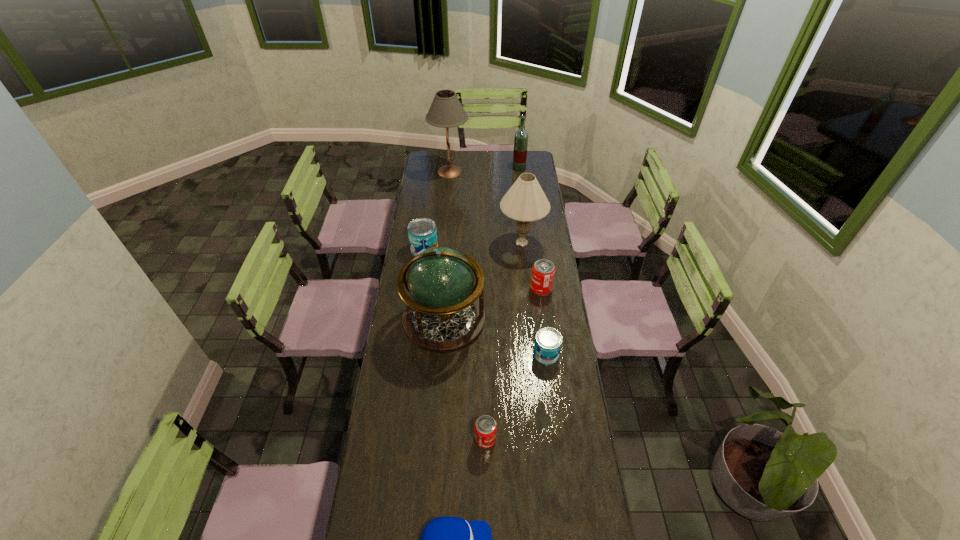
Where is `table lamp at the far edge`? The height and width of the screenshot is (540, 960). table lamp at the far edge is located at coordinates (446, 111).

What are the coordinates of `liquor that is at the far edge` in the screenshot? It's located at (521, 136).

Locate an element on the screen. The height and width of the screenshot is (540, 960). table lamp situated at the left edge is located at coordinates coord(446,111).

In order to click on globe at the left edge in this screenshot , I will do `click(445, 314)`.

You are a GUI agent. You are given a task and a screenshot of the screen. Output one action in this format:
    pyautogui.click(x=<x>, y=<y>)
    Task: Click on the can that is at the left edge
    
    Given the screenshot: What is the action you would take?
    pyautogui.click(x=422, y=232)

In order to click on lampshade positioned at the right edge in this screenshot , I will do `click(525, 201)`.

You are a GUI agent. You are given a task and a screenshot of the screen. Output one action in this format:
    pyautogui.click(x=<x>, y=<y>)
    Task: Click on the liquor positioned at the right edge
    Image resolution: width=960 pixels, height=540 pixels.
    Given the screenshot: What is the action you would take?
    pyautogui.click(x=521, y=136)

The width and height of the screenshot is (960, 540). I want to click on object that is at the far left corner, so point(446,111).

I want to click on object present at the far right corner, so click(x=521, y=136).

In the image, there is a desktop. Where is `vacant space at the far edge`? The height and width of the screenshot is (540, 960). vacant space at the far edge is located at coordinates (485, 166).